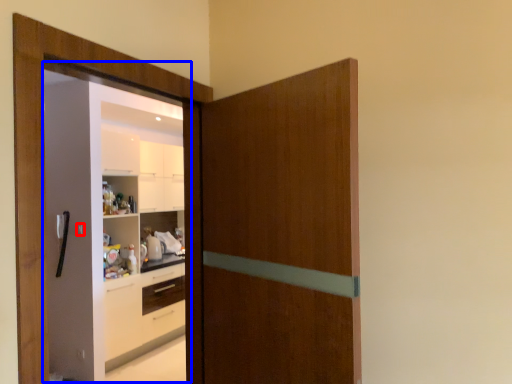
Question: Among these objects, which one is nearest to the camera, door handle (highlighted by a red box) or screen door (highlighted by a blue box)?

Choices:
 (A) door handle
 (B) screen door

Answer: (B)